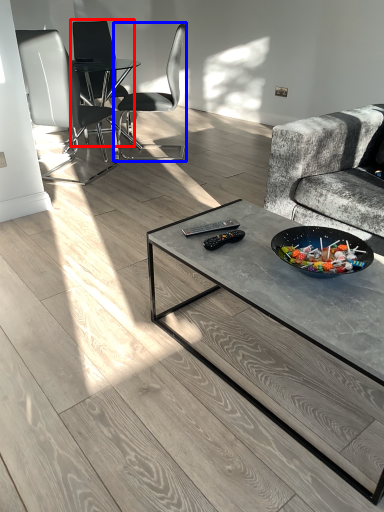
Question: Which point is further to the camera, chair (highlighted by a red box) or chair (highlighted by a blue box)?

Choices:
 (A) chair
 (B) chair

Answer: (A)